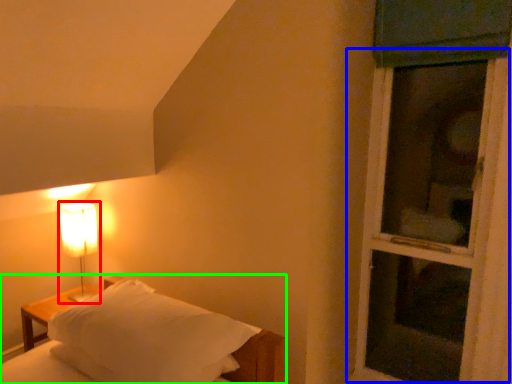
Question: Which is farther away from lamp (highlighted by a red box)? screen door (highlighted by a blue box) or bed (highlighted by a green box)?

Choices:
 (A) screen door
 (B) bed

Answer: (A)